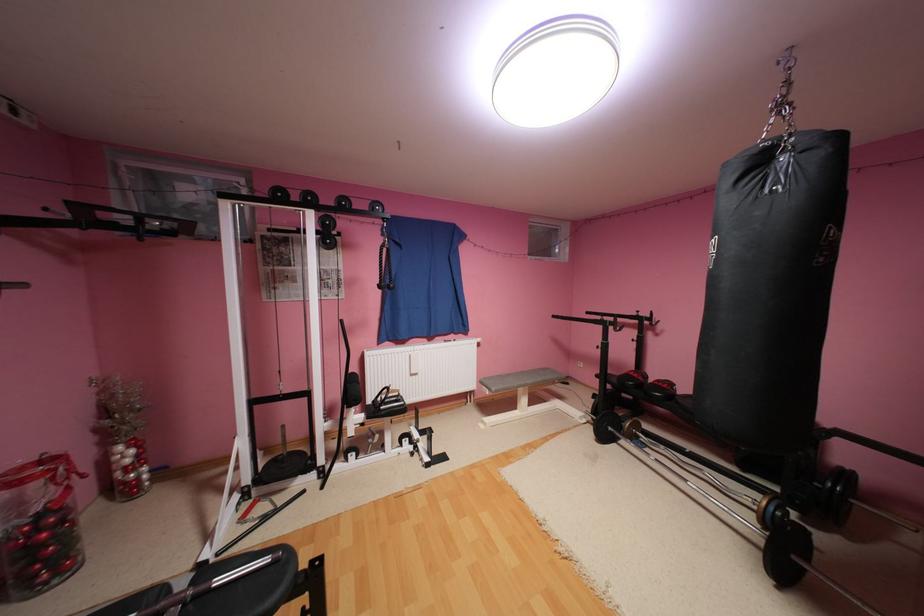
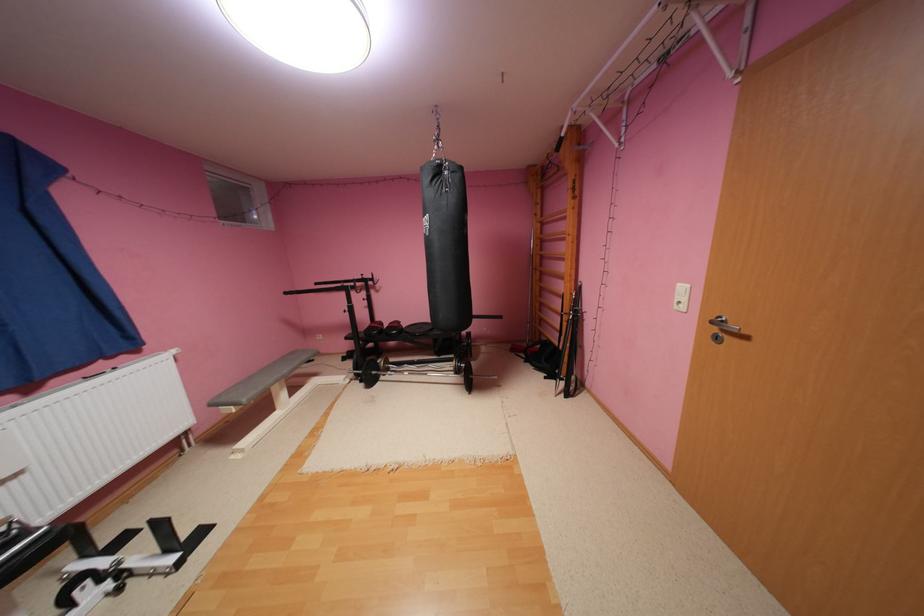
The point at (642, 438) is marked in the first image. Where is the corresponding point in the second image?

(396, 371)